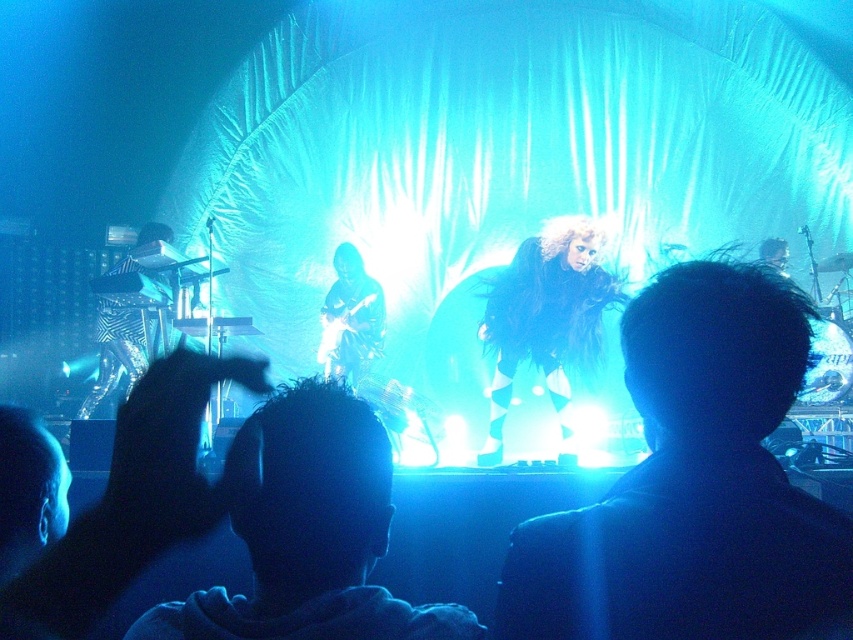
You are a photographer at the concert venue and want to capture a closeup shot of the dark hair at center while ensuring the fuzzy fur coat at center is still visible in the frame. Given the distance between them, what is the minimum focal length lens you should use if your camera sensor size is 36mm and you want both subjects to be in focus?

The fuzzy fur coat at center is 13.82 inches from dark hair at center. To capture both subjects in focus with a 36mm sensor, a lens with a focal length of at least 50mm is recommended to maintain sharpness and include both the dark hair at center and the fuzzy fur coat at center in the frame.

You are a photographer at the concert. You want to capture a closeup shot of the shiny black guitar at center and the fuzzy black wig at center. Which object should you focus on first if you want to ensure both are in focus?

The fuzzy black wig at center is below the shiny black guitar at center, so you should focus on the shiny black guitar at center first to ensure both are in focus.